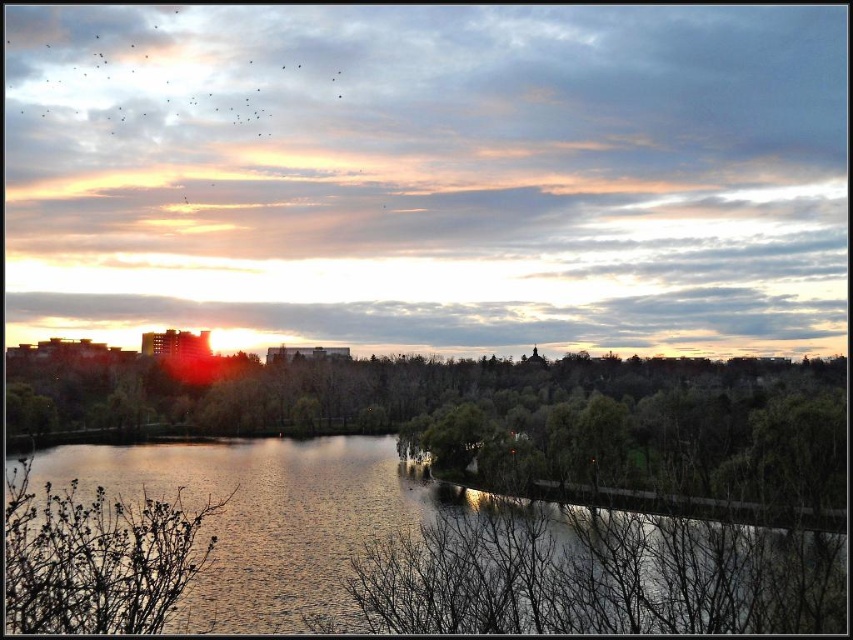
Is point (639, 371) farther from camera compared to point (80, 472)?

Yes, point (639, 371) is farther from viewer.

Does green leafy trees at center appear under glistening water at center?

Actually, green leafy trees at center is above glistening water at center.

Where is `green leafy trees at center`? The width and height of the screenshot is (853, 640). green leafy trees at center is located at coordinates click(480, 413).